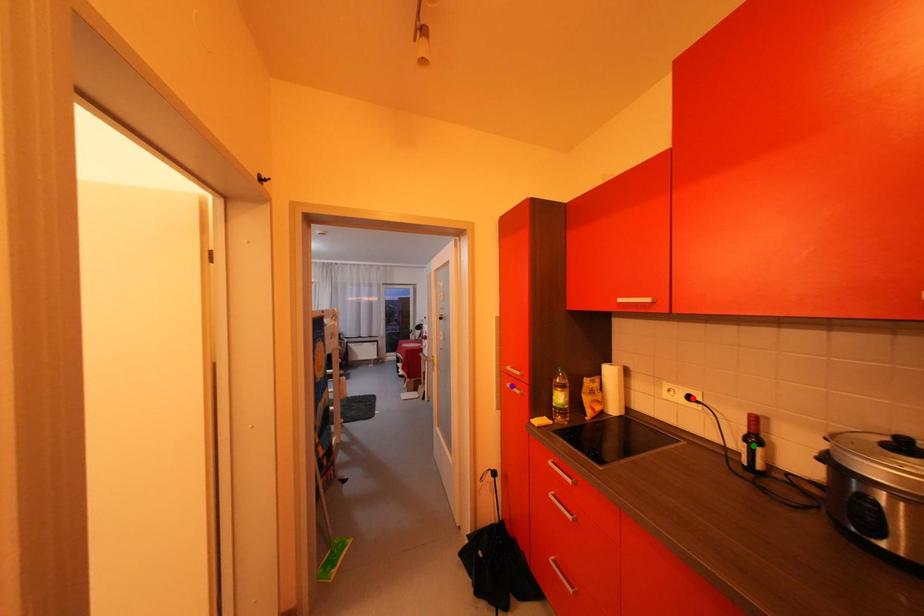
Order these from nearest to farthest:
red point, purple point, green point

green point
red point
purple point